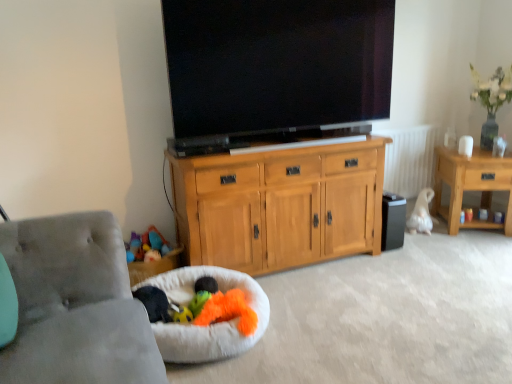
The height and width of the screenshot is (384, 512). I want to click on unoccupied area in front of light wood cabinet at center, so click(x=334, y=319).